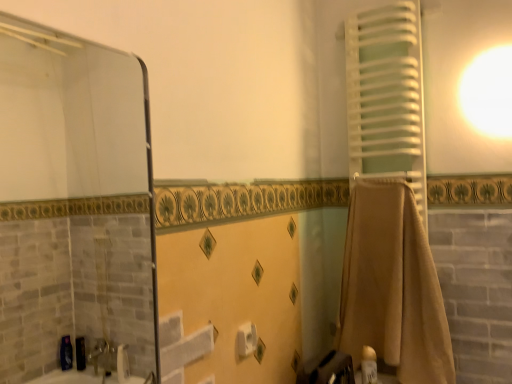
Question: Is white matte toilet paper at center in contact with white matte towel at right?

Choices:
 (A) no
 (B) yes

Answer: (A)

Question: From a real-world perspective, is white matte toilet paper at center physically below white matte towel at right?

Choices:
 (A) no
 (B) yes

Answer: (B)

Question: Would you say white matte toilet paper at center is outside white matte towel at right?

Choices:
 (A) yes
 (B) no

Answer: (A)

Question: Could you tell me if white matte toilet paper at center is turned towards white matte towel at right?

Choices:
 (A) no
 (B) yes

Answer: (A)

Question: From a real-world perspective, is white matte toilet paper at center on white matte towel at right?

Choices:
 (A) no
 (B) yes

Answer: (A)

Question: From the image's perspective, is white matte toilet paper at center located above white matte towel at right?

Choices:
 (A) yes
 (B) no

Answer: (B)

Question: From the image's perspective, would you say white matte toilet paper at center is positioned over beige cotton towel at right?

Choices:
 (A) yes
 (B) no

Answer: (B)

Question: Does white matte toilet paper at center have a greater width compared to beige cotton towel at right?

Choices:
 (A) yes
 (B) no

Answer: (B)

Question: Is white matte toilet paper at center facing away from beige cotton towel at right?

Choices:
 (A) no
 (B) yes

Answer: (A)

Question: Can you confirm if white matte toilet paper at center is shorter than beige cotton towel at right?

Choices:
 (A) no
 (B) yes

Answer: (B)

Question: Is white matte toilet paper at center positioned before beige cotton towel at right?

Choices:
 (A) yes
 (B) no

Answer: (A)

Question: Can you confirm if white matte toilet paper at center is positioned to the left of beige cotton towel at right?

Choices:
 (A) yes
 (B) no

Answer: (A)

Question: Would you say white glossy lotion at lower right is outside white matte towel at right?

Choices:
 (A) yes
 (B) no

Answer: (A)